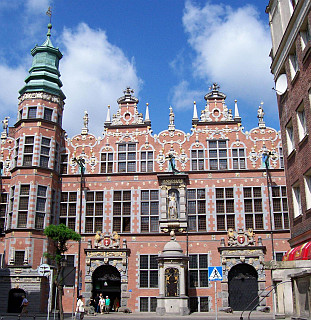
What are the coordinates of `arched doors` in the screenshot? It's located at (241, 290).